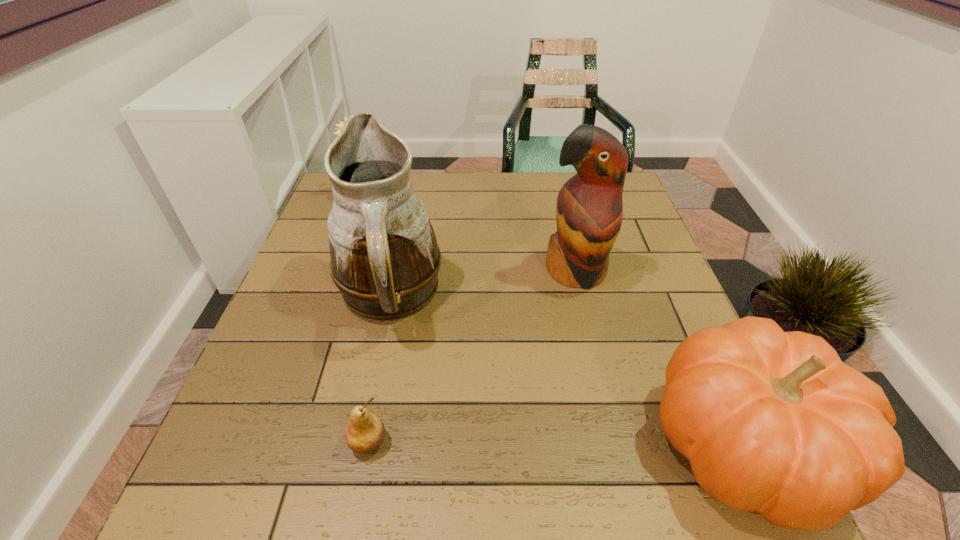
In order to click on pear in this screenshot , I will do `click(365, 431)`.

The height and width of the screenshot is (540, 960). I want to click on the farthest object, so click(x=341, y=124).

Where is `pitcher`? Image resolution: width=960 pixels, height=540 pixels. pitcher is located at coordinates (385, 259).

Identify the location of parrot. The image size is (960, 540). (589, 209).

Locate an element on the screen. vacant region located 0.370m on the back of the shortest object is located at coordinates tap(399, 282).

Locate an element on the screen. This screenshot has height=540, width=960. free space located on the front-facing side of the farthest object is located at coordinates (408, 256).

Find the location of `vacant point located on the front-facing side of the farthest object`. vacant point located on the front-facing side of the farthest object is located at coordinates [x=428, y=287].

Image resolution: width=960 pixels, height=540 pixels. I want to click on vacant space located on the front-facing side of the farthest object, so click(417, 270).

Locate an element on the screen. The width and height of the screenshot is (960, 540). vacant space located 0.150m from the spout of the pitcher is located at coordinates (478, 369).

Locate an element on the screen. vacant space positioned 0.370m from the spout of the pitcher is located at coordinates coord(573,439).